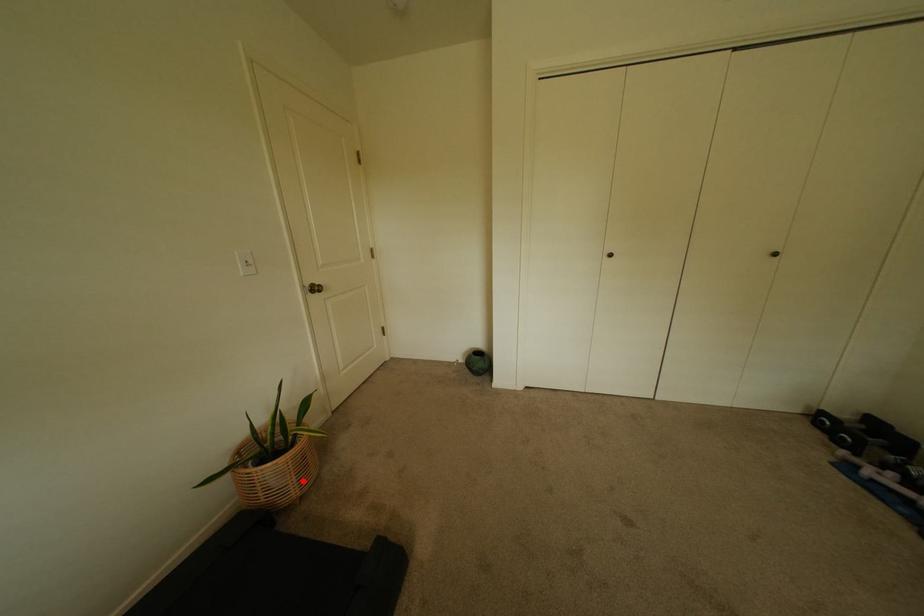
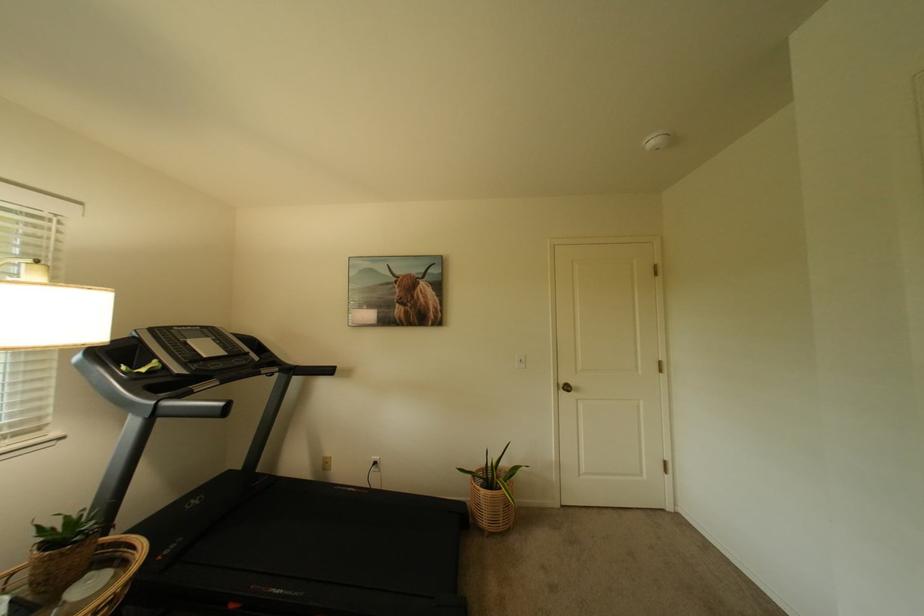
The point at the highlighted location is marked in the first image. Where is the corresponding point in the second image?

(495, 515)